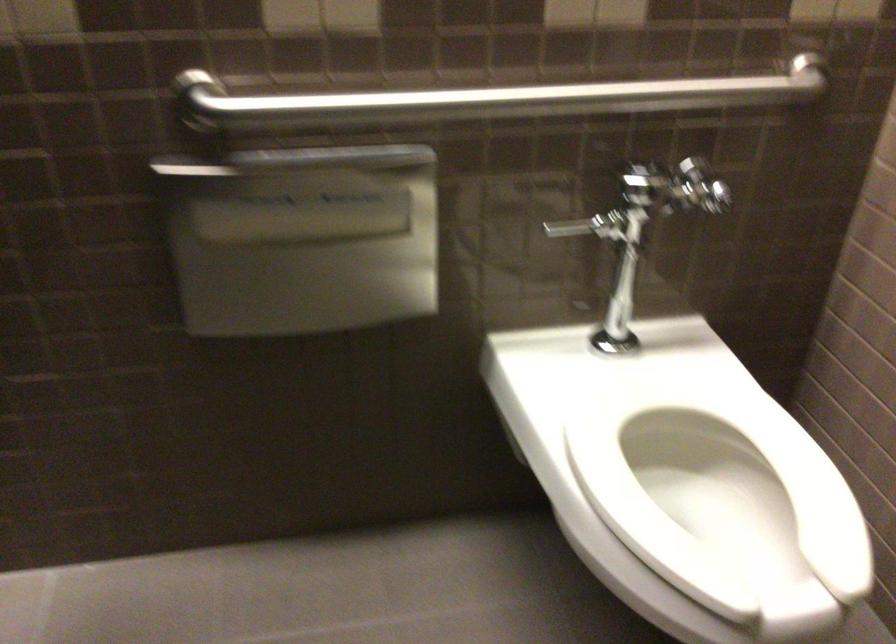
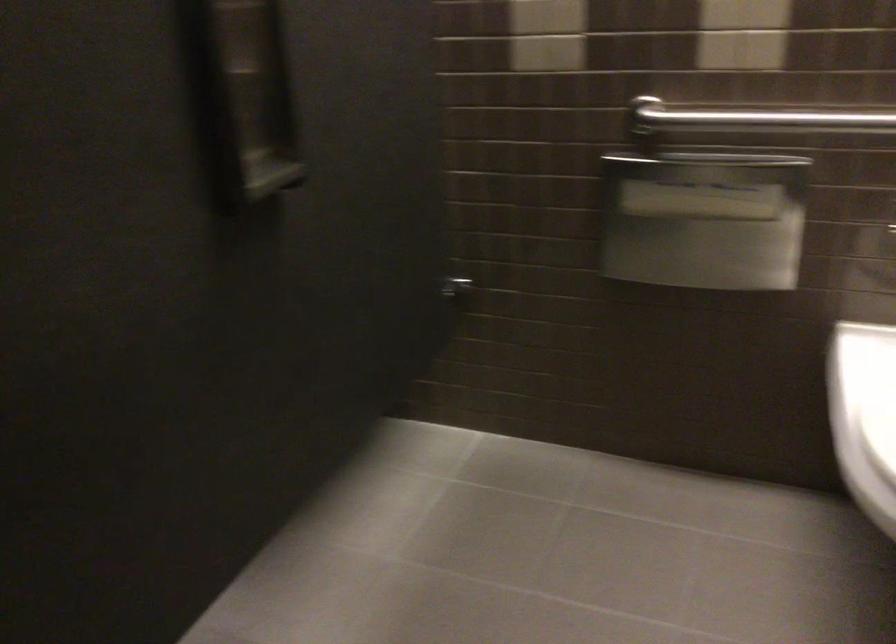
Question: How did the camera likely rotate?

Choices:
 (A) Left
 (B) Right
 (C) Up
 (D) Down

Answer: (A)